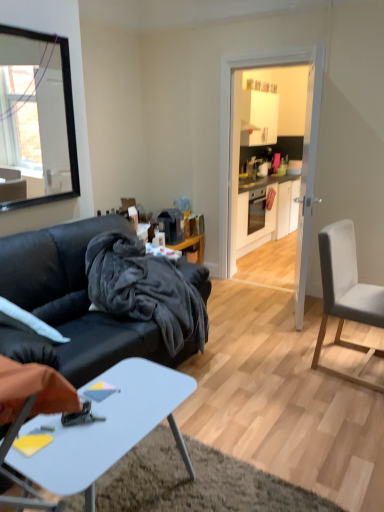
Question: Does white glossy cabinet at upper center have a larger size compared to white glossy door at center?

Choices:
 (A) no
 (B) yes

Answer: (B)

Question: Does white glossy cabinet at upper center have a lesser width compared to white glossy door at center?

Choices:
 (A) no
 (B) yes

Answer: (A)

Question: From the image's perspective, would you say white glossy cabinet at upper center is shown under white glossy door at center?

Choices:
 (A) yes
 (B) no

Answer: (B)

Question: Is white glossy cabinet at upper center aimed at white glossy door at center?

Choices:
 (A) yes
 (B) no

Answer: (B)

Question: From a real-world perspective, is white glossy cabinet at upper center located higher than white glossy door at center?

Choices:
 (A) no
 (B) yes

Answer: (B)

Question: Does white glossy cabinet at upper center appear on the right side of white glossy door at center?

Choices:
 (A) yes
 (B) no

Answer: (A)

Question: Is white plastic desk at lower center facing away from white glossy cabinet at center?

Choices:
 (A) no
 (B) yes

Answer: (A)

Question: Can you confirm if white plastic desk at lower center is smaller than white glossy cabinet at center?

Choices:
 (A) yes
 (B) no

Answer: (A)

Question: Does white plastic desk at lower center have a greater width compared to white glossy cabinet at center?

Choices:
 (A) no
 (B) yes

Answer: (A)

Question: Does white plastic desk at lower center turn towards white glossy cabinet at center?

Choices:
 (A) yes
 (B) no

Answer: (B)

Question: Considering the relative positions of white plastic desk at lower center and white glossy cabinet at center in the image provided, is white plastic desk at lower center to the left of white glossy cabinet at center from the viewer's perspective?

Choices:
 (A) yes
 (B) no

Answer: (A)

Question: Is white plastic desk at lower center shorter than white glossy cabinet at center?

Choices:
 (A) no
 (B) yes

Answer: (B)

Question: From a real-world perspective, is white glossy door at center physically above light gray fabric chair at right?

Choices:
 (A) no
 (B) yes

Answer: (B)